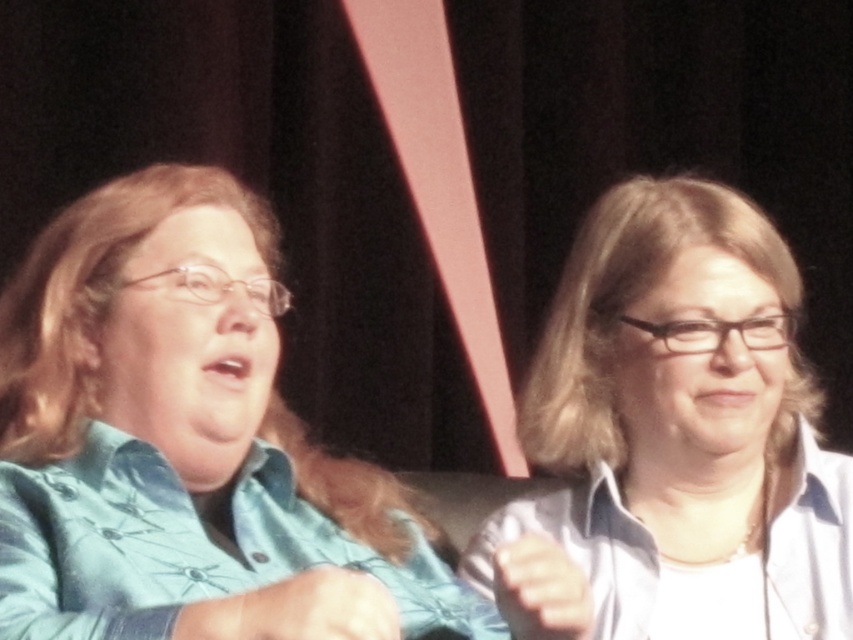
Question: Among these objects, which one is farthest from the camera?

Choices:
 (A) teal fabric shirt at left
 (B) white glossy shirt at upper right

Answer: (B)

Question: Is teal fabric shirt at left positioned in front of white glossy shirt at upper right?

Choices:
 (A) yes
 (B) no

Answer: (A)

Question: Does teal fabric shirt at left appear on the left side of white glossy shirt at upper right?

Choices:
 (A) no
 (B) yes

Answer: (B)

Question: Can you confirm if teal fabric shirt at left is positioned below white glossy shirt at upper right?

Choices:
 (A) no
 (B) yes

Answer: (A)

Question: Which point appears farthest from the camera in this image?

Choices:
 (A) (390, 550)
 (B) (647, 628)

Answer: (B)